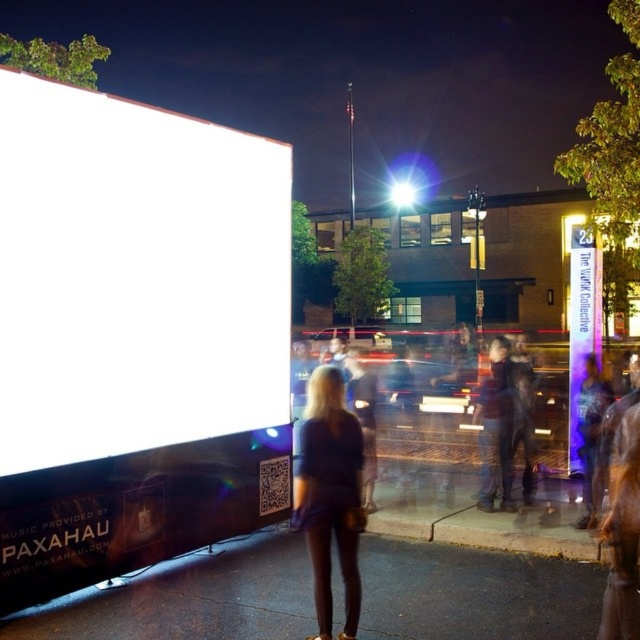
Question: Based on their relative distances, which object is nearer to the dark blue fabric dress at center?

Choices:
 (A) translucent purple sign at center
 (B) white glossy screen at upper left

Answer: (B)

Question: Does white glossy screen at upper left have a smaller size compared to translucent purple sign at center?

Choices:
 (A) yes
 (B) no

Answer: (A)

Question: Does dark blue fabric dress at center have a greater width compared to translucent purple sign at center?

Choices:
 (A) yes
 (B) no

Answer: (B)

Question: Which point is closer to the camera taking this photo?

Choices:
 (A) (572, 285)
 (B) (294, 516)
 (C) (141, 196)

Answer: (C)

Question: Which point is closer to the camera?

Choices:
 (A) (310, 406)
 (B) (596, 328)

Answer: (A)

Question: From the image, what is the correct spatial relationship of white glossy screen at upper left in relation to dark blue fabric dress at center?

Choices:
 (A) below
 (B) above

Answer: (B)